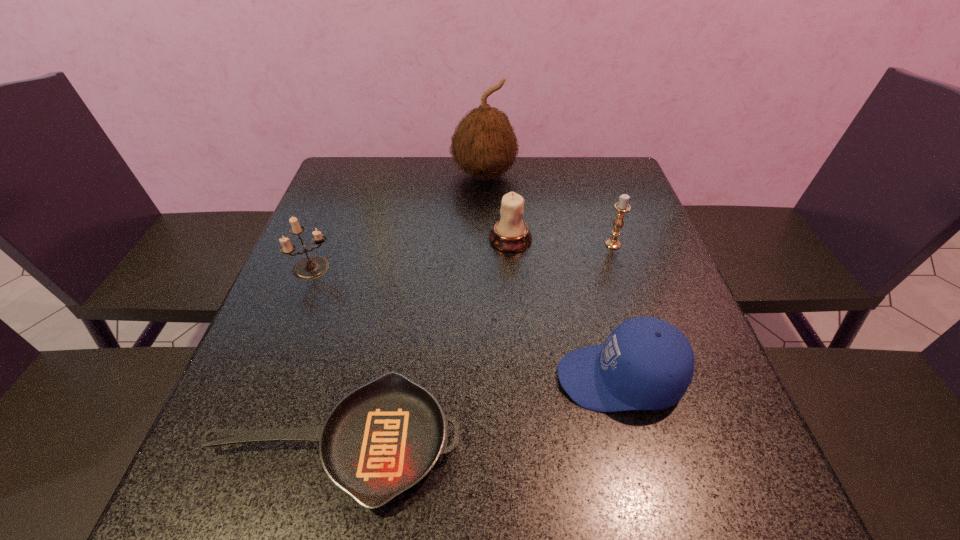
You are a GUI agent. You are given a task and a screenshot of the screen. Output one action in this format:
    pyautogui.click(x=<x>, y=<y>)
    Task: Click on the free space located on the left of the second candle holder from left to right
    The width and height of the screenshot is (960, 540).
    Given the screenshot: What is the action you would take?
    pyautogui.click(x=354, y=239)

Image resolution: width=960 pixels, height=540 pixels. I want to click on free location located 0.350m on the front-facing side of the cap, so click(369, 378).

Find the location of a particular element. This screenshot has width=960, height=540. vacant space situated on the front-facing side of the cap is located at coordinates (342, 378).

You are a GUI agent. You are given a task and a screenshot of the screen. Output one action in this format:
    pyautogui.click(x=<x>, y=<y>)
    Task: Click on the vacant point located 0.360m on the front-facing side of the cap
    The width and height of the screenshot is (960, 540).
    Given the screenshot: What is the action you would take?
    pyautogui.click(x=363, y=378)

Locate an element on the screen. The height and width of the screenshot is (540, 960). vacant area situated on the front of the leftmost candle holder is located at coordinates point(267,386).

Find the location of a particular element. The image size is (960, 540). free space located on the right of the shortest object is located at coordinates (521, 442).

What are the coordinates of `object that is at the far edge` in the screenshot? It's located at (484, 144).

You are a GUI agent. You are given a task and a screenshot of the screen. Output one action in this format:
    pyautogui.click(x=<x>, y=<y>)
    Task: Click on the object at the near edge
    The height and width of the screenshot is (540, 960).
    Given the screenshot: What is the action you would take?
    pyautogui.click(x=384, y=437)

This screenshot has width=960, height=540. I want to click on candle holder that is positioned at the left edge, so click(x=311, y=267).

The width and height of the screenshot is (960, 540). Find the location of `frying pan that is at the left edge`. frying pan that is at the left edge is located at coordinates (384, 437).